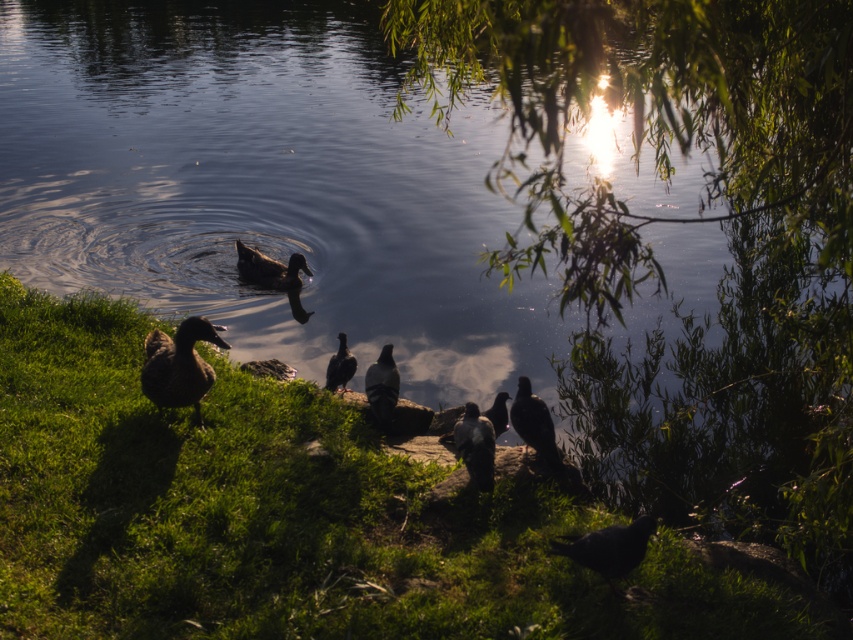
Find the location of a particular element. shiny black pigeon at center is located at coordinates (381, 385).

Is shiny black pigeon at center behind brown matte bird at lower left?

That is False.

I want to click on shiny black pigeon at center, so click(381, 385).

Find the location of a particular element. This screenshot has height=640, width=853. shiny black pigeon at center is located at coordinates pyautogui.click(x=381, y=385).

In the scene shown: Between green grass at lower left and silhouette feathered bird at center, which one has less height?

green grass at lower left is shorter.

Identify the location of green grass at lower left. pyautogui.click(x=287, y=515).

Who is shorter, dark brown feathered duck at lower left or shiny black bird at lower right?

shiny black bird at lower right is shorter.

Can you confirm if dark brown feathered duck at lower left is positioned to the right of shiny black bird at lower right?

No, dark brown feathered duck at lower left is not to the right of shiny black bird at lower right.

Describe the element at coordinates (178, 365) in the screenshot. I see `dark brown feathered duck at lower left` at that location.

I want to click on dark brown feathered duck at lower left, so click(178, 365).